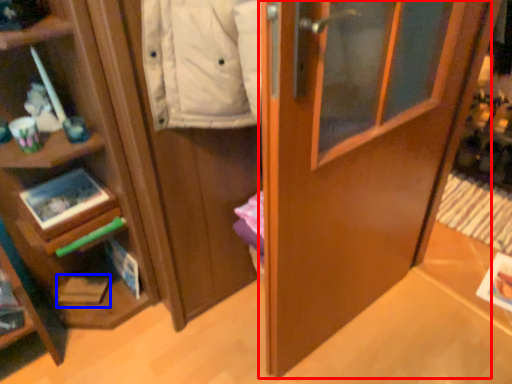
Question: Which object is closer to the camera taking this photo, door (highlighted by a red box) or magazine (highlighted by a blue box)?

Choices:
 (A) door
 (B) magazine

Answer: (A)